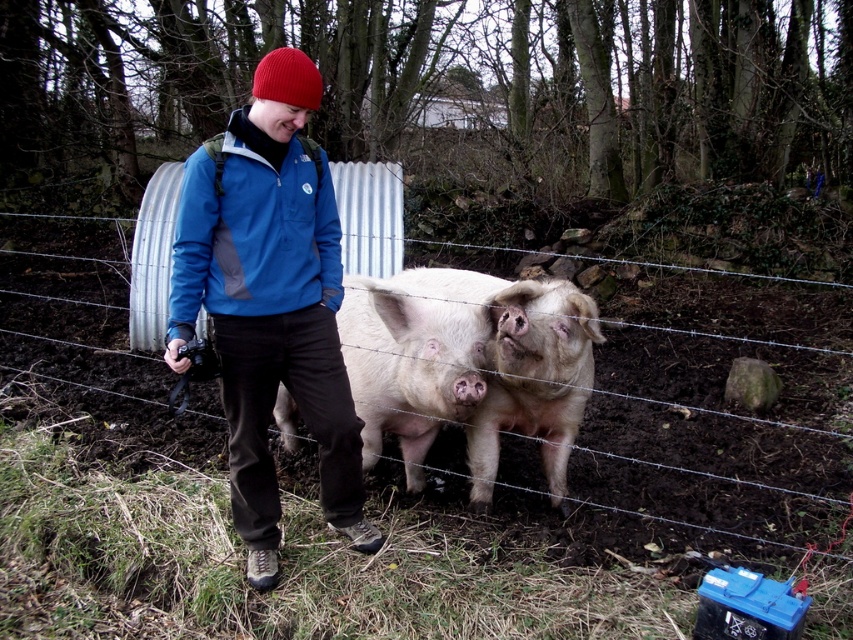
Question: Does barbed wire fence at center appear on the right side of pink soft fur at center?

Choices:
 (A) yes
 (B) no

Answer: (B)

Question: Is barbed wire fence at center behind pink soft fur at center?

Choices:
 (A) yes
 (B) no

Answer: (A)

Question: Which object is the farthest from the pinkish-white flesh at center?

Choices:
 (A) pink soft fur at center
 (B) barbed wire fence at center
 (C) blue fleece jacket at center

Answer: (B)

Question: Which object appears closest to the camera in this image?

Choices:
 (A) barbed wire fence at center
 (B) blue fleece jacket at center
 (C) pink soft fur at center
 (D) pinkish-white flesh at center

Answer: (B)

Question: Which object appears closest to the camera in this image?

Choices:
 (A) pinkish-white flesh at center
 (B) pink soft fur at center
 (C) blue fleece jacket at center

Answer: (C)

Question: Is blue fleece jacket at center below pink soft fur at center?

Choices:
 (A) yes
 (B) no

Answer: (B)